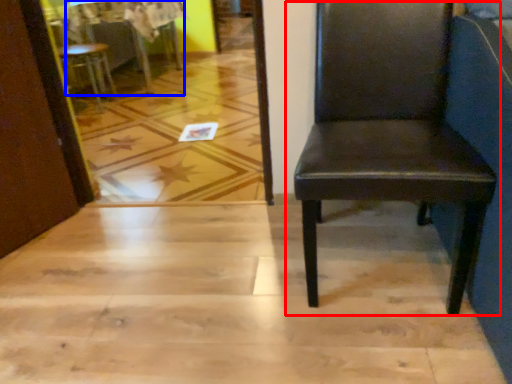
Question: Which of the following is the farthest to the observer, chair (highlighted by a red box) or table (highlighted by a blue box)?

Choices:
 (A) chair
 (B) table

Answer: (B)